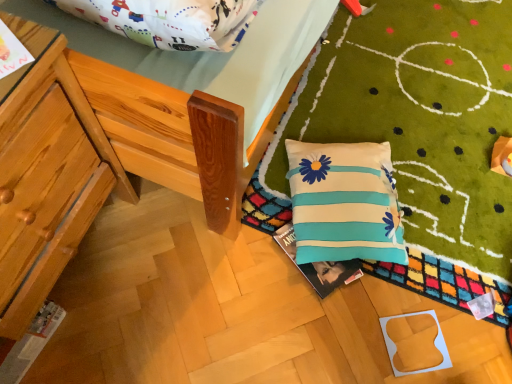
Question: Is wooden chair at left bigger or smaller than white fabric pillow with blue stripes and flower patterns at lower right?

Choices:
 (A) small
 (B) big

Answer: (B)

Question: In terms of height, does wooden chair at left look taller or shorter compared to white fabric pillow with blue stripes and flower patterns at lower right?

Choices:
 (A) short
 (B) tall

Answer: (B)

Question: Does point tap(62, 148) appear closer or farther from the camera than point tap(347, 208)?

Choices:
 (A) closer
 (B) farther

Answer: (A)

Question: Do you think white fabric pillow with blue stripes and flower patterns at lower right is within wooden chair at left, or outside of it?

Choices:
 (A) inside
 (B) outside

Answer: (B)

Question: In the image, is white fabric pillow with blue stripes and flower patterns at lower right on the left side or the right side of wooden chair at left?

Choices:
 (A) right
 (B) left

Answer: (A)

Question: Looking at the image, does white fabric pillow with blue stripes and flower patterns at lower right seem bigger or smaller compared to wooden chair at left?

Choices:
 (A) big
 (B) small

Answer: (B)

Question: From their relative heights in the image, would you say white fabric pillow with blue stripes and flower patterns at lower right is taller or shorter than wooden chair at left?

Choices:
 (A) tall
 (B) short

Answer: (B)